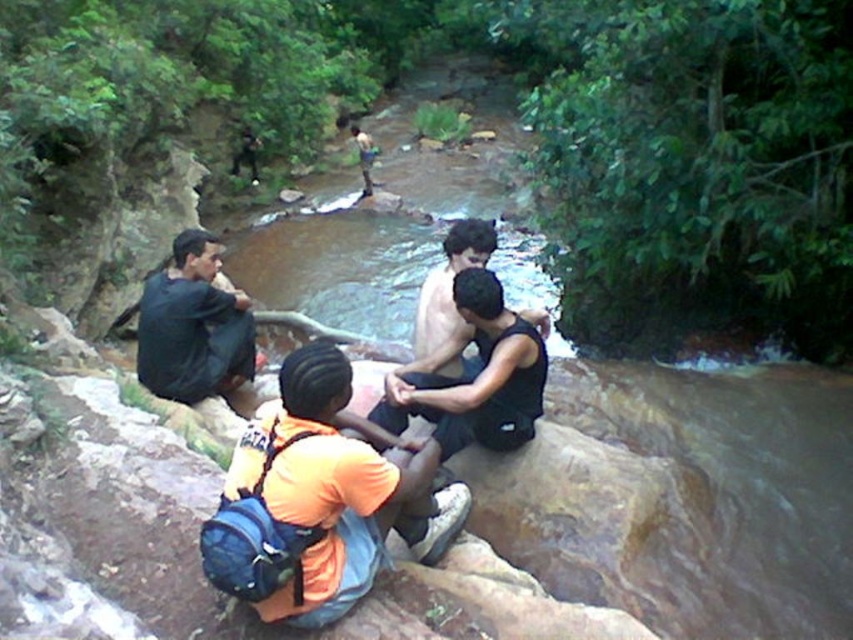
Question: Is black matte shorts at center below shiny black tank top at center?

Choices:
 (A) no
 (B) yes

Answer: (B)

Question: Which object is closer to the camera taking this photo?

Choices:
 (A) orange fabric backpack at center
 (B) dark blue fabric shirt at left
 (C) shiny black tank top at center

Answer: (A)

Question: Is dark blue fabric shirt at left bigger than shiny black tank top at center?

Choices:
 (A) no
 (B) yes

Answer: (B)

Question: Which object appears closest to the camera in this image?

Choices:
 (A) shiny black tank top at center
 (B) dark blue fabric shirt at left
 (C) black matte shorts at center
 (D) orange fabric backpack at center

Answer: (D)

Question: Is orange fabric backpack at center above black matte shorts at center?

Choices:
 (A) no
 (B) yes

Answer: (A)

Question: Considering the real-world distances, which object is farthest from the black matte shorts at center?

Choices:
 (A) orange fabric backpack at center
 (B) dark blue fabric shirt at left

Answer: (B)